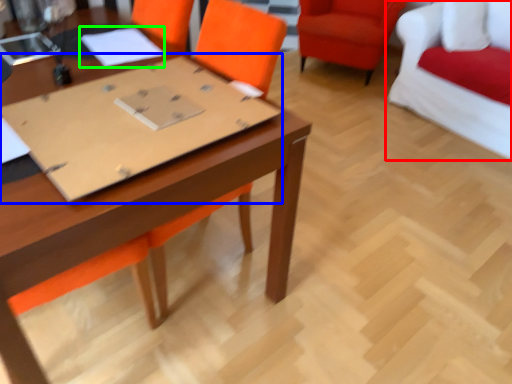
Question: Which object is the farthest from chair (highlighted by a red box)? Choose among these: cardboard (highlighted by a blue box) or notebook (highlighted by a green box).

Choices:
 (A) cardboard
 (B) notebook

Answer: (A)